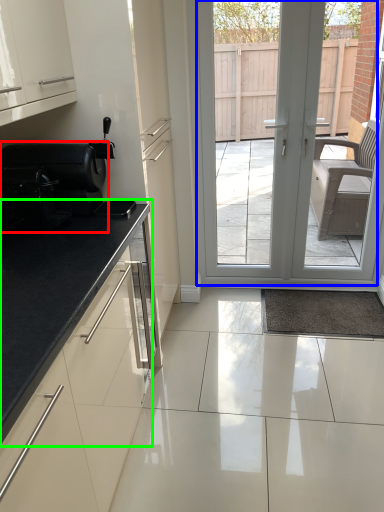
Question: Which object is positioned farthest from appliance (highlighted by a red box)? Select from door (highlighted by a blue box) and countertop (highlighted by a green box).

Choices:
 (A) door
 (B) countertop

Answer: (A)